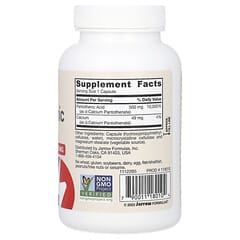
Find the location of a particular element. bottle is located at coordinates (120, 225).